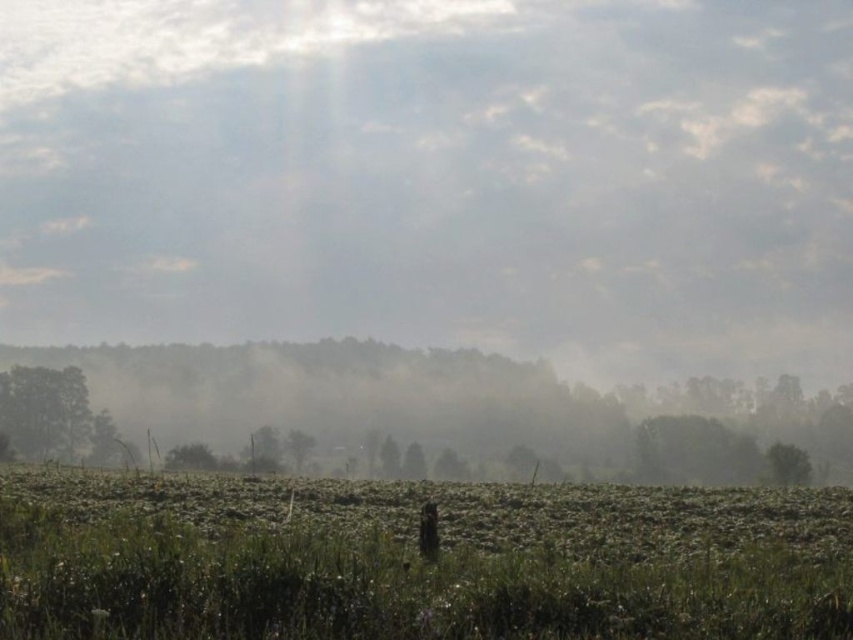
Is point (445, 209) positioned behind point (706, 595)?

Yes, it is.

What are the coordinates of `foggy mist at center` in the screenshot? It's located at (434, 179).